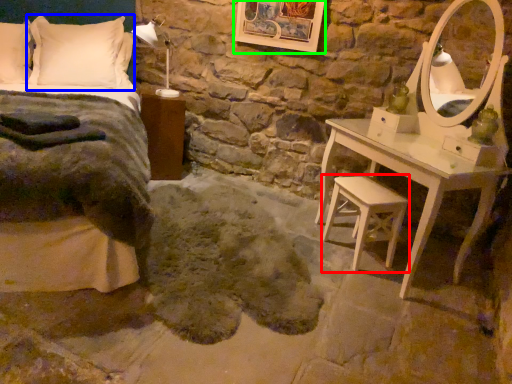
Question: Based on their relative distances, which object is nearer to swivel chair (highlighted by a red box)? Choose from pillow (highlighted by a blue box) and picture frame (highlighted by a green box).

Choices:
 (A) pillow
 (B) picture frame

Answer: (B)